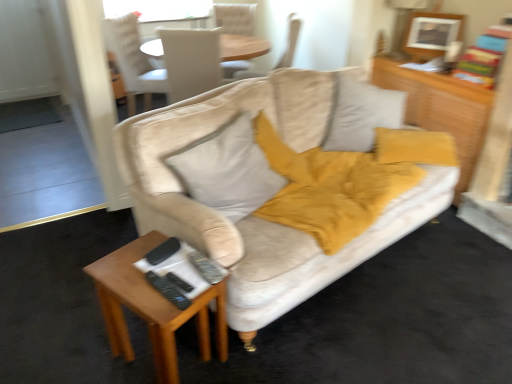
Question: Considering the relative sizes of wooden rectangular table at lower left and beige fabric chair at upper center, arranged as the second chair when viewed from the left, in the image provided, is wooden rectangular table at lower left smaller than beige fabric chair at upper center, arranged as the second chair when viewed from the left,?

Choices:
 (A) yes
 (B) no

Answer: (A)

Question: Is wooden rectangular table at lower left looking in the opposite direction of beige fabric chair at upper center, the third chair from the right?

Choices:
 (A) yes
 (B) no

Answer: (B)

Question: Is wooden rectangular table at lower left not close to beige fabric chair at upper center, the third chair from the right?

Choices:
 (A) no
 (B) yes

Answer: (B)

Question: From a real-world perspective, does wooden rectangular table at lower left sit lower than beige fabric chair at upper center, the third chair from the right?

Choices:
 (A) yes
 (B) no

Answer: (A)

Question: Is wooden rectangular table at lower left closer to the viewer compared to beige fabric chair at upper center, the third chair from the right?

Choices:
 (A) yes
 (B) no

Answer: (A)

Question: Can beige fabric chair at upper center, the third chair from the right, be found inside wooden rectangular table at lower left?

Choices:
 (A) no
 (B) yes

Answer: (A)

Question: Is beige fabric chair at upper center, which ranks as the first chair in right-to-left order, not near wooden dresser at upper right?

Choices:
 (A) no
 (B) yes

Answer: (B)

Question: From the image's perspective, is beige fabric chair at upper center, the fourth chair from the left, beneath wooden dresser at upper right?

Choices:
 (A) yes
 (B) no

Answer: (B)

Question: Would you say beige fabric chair at upper center, the fourth chair from the left, contains wooden dresser at upper right?

Choices:
 (A) yes
 (B) no

Answer: (B)

Question: Considering the relative positions of beige fabric chair at upper center, which ranks as the first chair in right-to-left order, and wooden dresser at upper right in the image provided, is beige fabric chair at upper center, which ranks as the first chair in right-to-left order, to the left of wooden dresser at upper right from the viewer's perspective?

Choices:
 (A) yes
 (B) no

Answer: (A)

Question: Can you confirm if beige fabric chair at upper center, the fourth chair from the left, is smaller than wooden dresser at upper right?

Choices:
 (A) no
 (B) yes

Answer: (A)

Question: Is beige fabric chair at upper center, which ranks as the first chair in right-to-left order, positioned with its back to wooden dresser at upper right?

Choices:
 (A) no
 (B) yes

Answer: (A)

Question: Is wooden dresser at upper right completely or partially outside of soft white pillow at center?

Choices:
 (A) yes
 (B) no

Answer: (A)